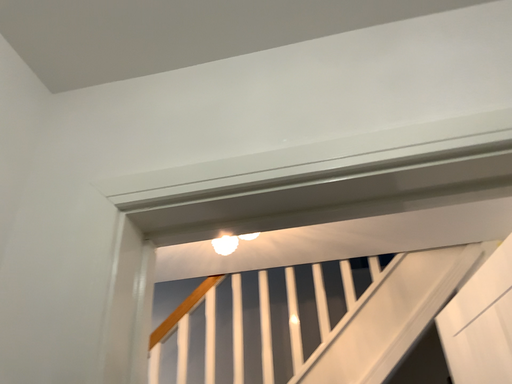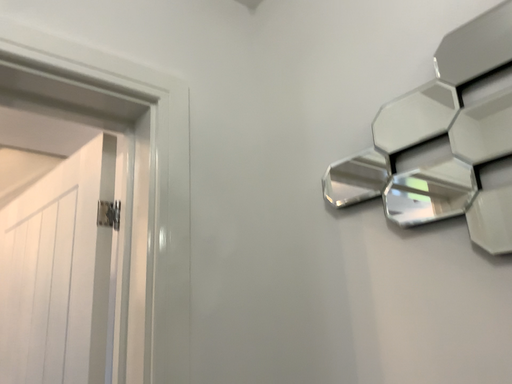
Question: Which way did the camera rotate in the video?

Choices:
 (A) rotated right
 (B) rotated left

Answer: (A)